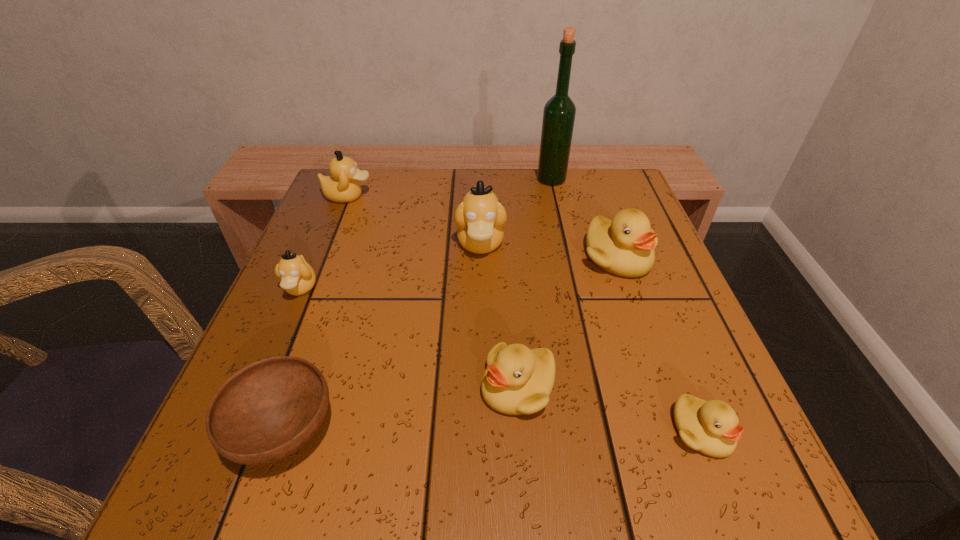
Where is `vacant area at the far edge of the desktop`? Image resolution: width=960 pixels, height=540 pixels. vacant area at the far edge of the desktop is located at coordinates (x=408, y=206).

The image size is (960, 540). What are the coordinates of `free space at the near edge of the desktop` in the screenshot? It's located at (503, 500).

This screenshot has width=960, height=540. What are the coordinates of `vacant space at the left edge of the desktop` in the screenshot? It's located at (283, 334).

Identify the location of vacant space at the right edge. (622, 321).

In the image, there is a desktop. Find the location of `free space at the near left corner`. free space at the near left corner is located at coordinates (309, 449).

This screenshot has width=960, height=540. I want to click on blank space at the far right corner of the desktop, so click(585, 216).

You are a GUI agent. You are given a task and a screenshot of the screen. Output one action in this format:
    pyautogui.click(x=<x>, y=<y>)
    Task: Click on the empty location between the farthest yellow duckling and the shortest duckling
    
    Given the screenshot: What is the action you would take?
    pyautogui.click(x=660, y=345)

You are a GUI agent. You are given a task and a screenshot of the screen. Output one action in this format:
    pyautogui.click(x=<x>, y=<y>)
    Task: Click on the free space between the farthest object and the smallest yellow duckling
    
    Given the screenshot: What is the action you would take?
    pyautogui.click(x=627, y=305)

Locate an element on the screen. The image size is (960, 540). free point between the second biggest yellow duckling and the farthest yellow duckling is located at coordinates (567, 322).

At what (x,y) coordinates should I click in order to perform the action: click on vacant space in between the bowl and the shortest duckling. Please return your answer as a coordinate pair (x, y). Looking at the image, I should click on (493, 431).